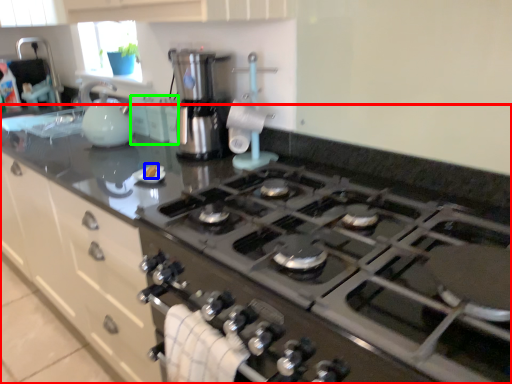
Question: Estimate the real-world distances between objects in this image. Which object is farther from countertop (highlighted by a red box), food (highlighted by a blue box) or cabinetry (highlighted by a green box)?

Choices:
 (A) food
 (B) cabinetry

Answer: (B)